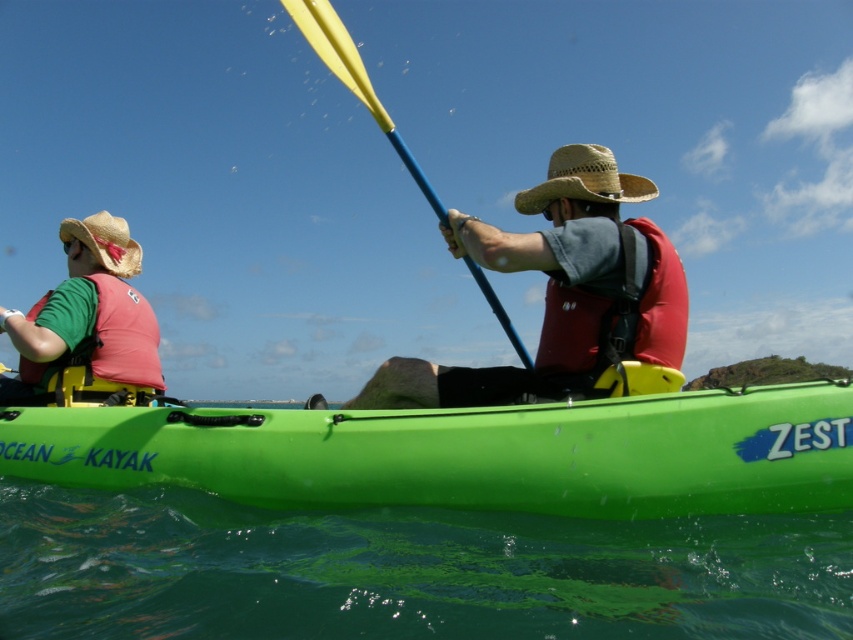
Is matte red life vest at center above straw woven hat at center?

No.

Consider the image. Who is more distant from viewer, (410, 376) or (616, 170)?

Point (616, 170)

What do you see at coordinates (561, 291) in the screenshot? The height and width of the screenshot is (640, 853). I see `matte red life vest at center` at bounding box center [561, 291].

Identify the location of matte red life vest at center. (561, 291).

Does yellowsmoothpaddle at center have a lesser width compared to straw woven hat at center?

No.

Which is behind, point (485, 289) or point (584, 163)?

The point (485, 289) is behind.

The height and width of the screenshot is (640, 853). Find the location of `yellowsmoothpaddle at center`. yellowsmoothpaddle at center is located at coordinates (352, 77).

Who is positioned more to the right, matte red life vest at center or red matte life jacket at center?

From the viewer's perspective, red matte life jacket at center appears more on the right side.

Can you confirm if matte red life vest at center is smaller than red matte life jacket at center?

No, matte red life vest at center is not smaller than red matte life jacket at center.

This screenshot has height=640, width=853. What do you see at coordinates (561, 291) in the screenshot? I see `matte red life vest at center` at bounding box center [561, 291].

Find the location of a particular element. The height and width of the screenshot is (640, 853). matte red life vest at center is located at coordinates (561, 291).